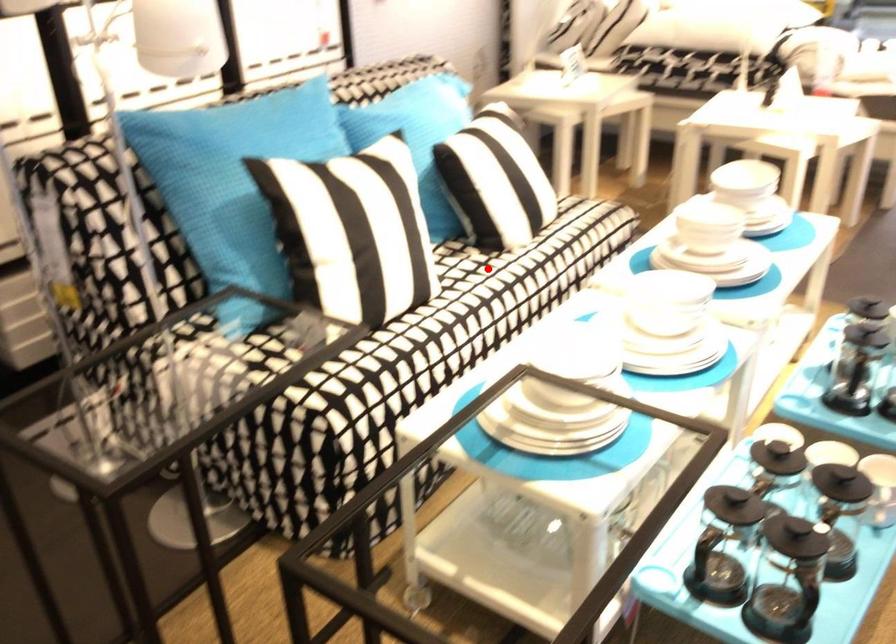
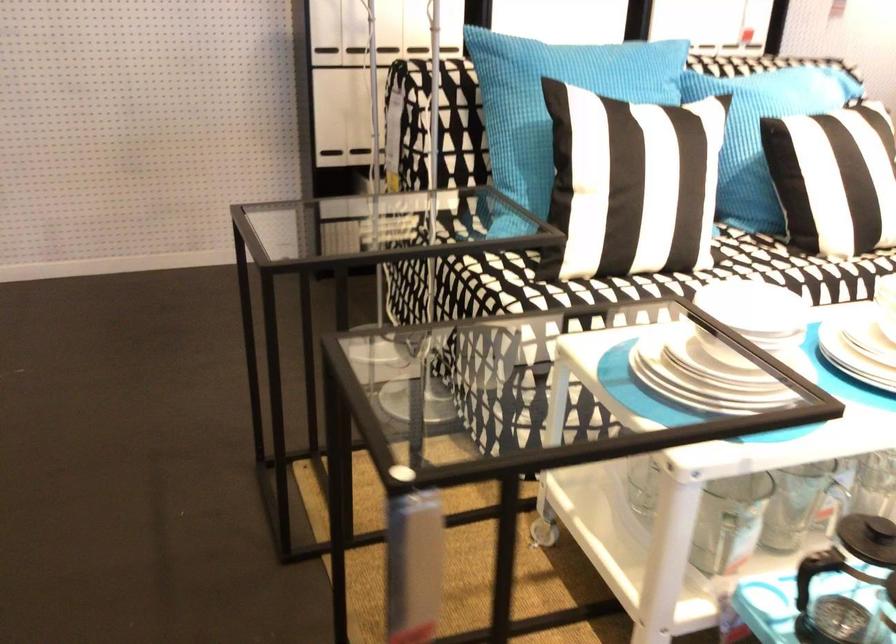
The point at the highlighted location is marked in the first image. Where is the corresponding point in the second image?

(782, 263)